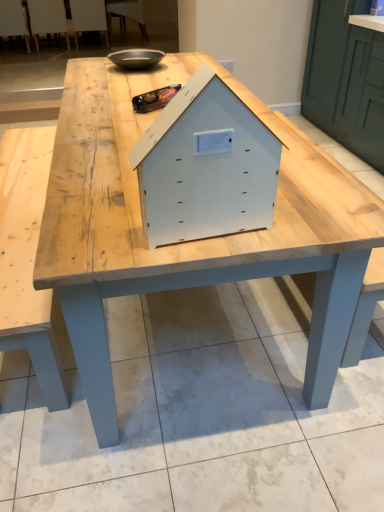
Locate an element on the screen. vacant space to the right of white matte wooden house at center is located at coordinates (299, 221).